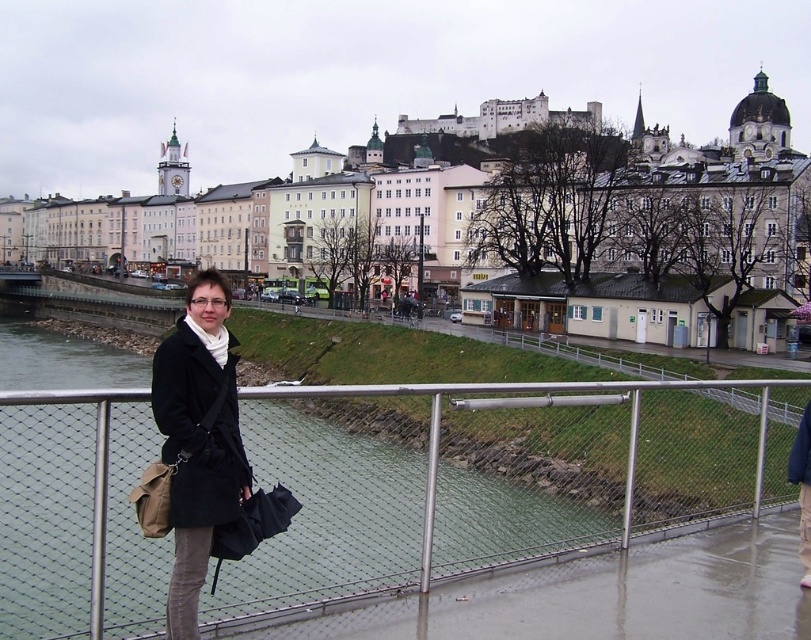
Question: Does metal mesh fence at lower center lie in front of black matte coat at center?

Choices:
 (A) yes
 (B) no

Answer: (A)

Question: Which of the following is the farthest from the observer?

Choices:
 (A) (440, 436)
 (B) (187, 566)

Answer: (A)

Question: Does metal mesh fence at lower center appear on the left side of black matte coat at center?

Choices:
 (A) no
 (B) yes

Answer: (A)

Question: Which object is closer to the camera taking this photo?

Choices:
 (A) metal mesh fence at lower center
 (B) black matte coat at center

Answer: (A)

Question: Which object is farther from the camera taking this photo?

Choices:
 (A) black matte coat at center
 (B) metal mesh fence at lower center

Answer: (A)

Question: Is metal mesh fence at lower center below black matte coat at center?

Choices:
 (A) yes
 (B) no

Answer: (A)